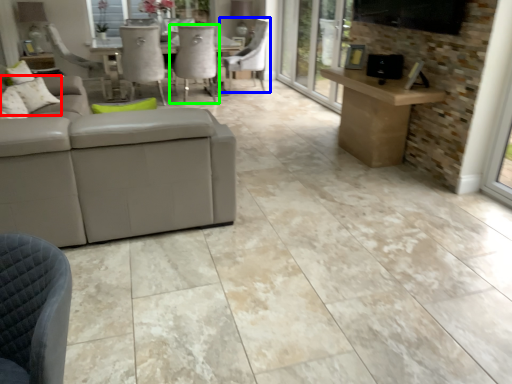
Question: Considering the real-world distances, which object is farthest from pillow (highlighted by a red box)? chair (highlighted by a blue box) or chair (highlighted by a green box)?

Choices:
 (A) chair
 (B) chair

Answer: (A)